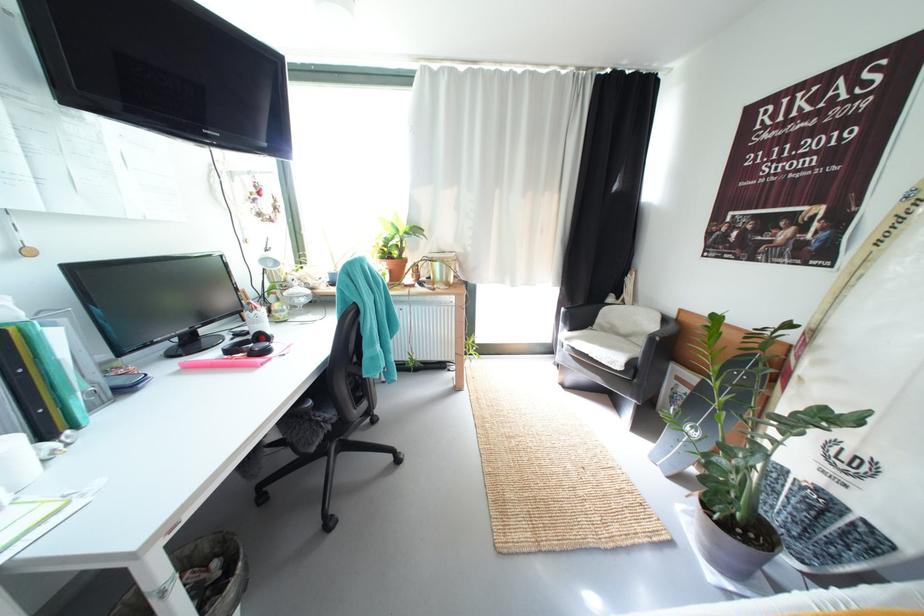
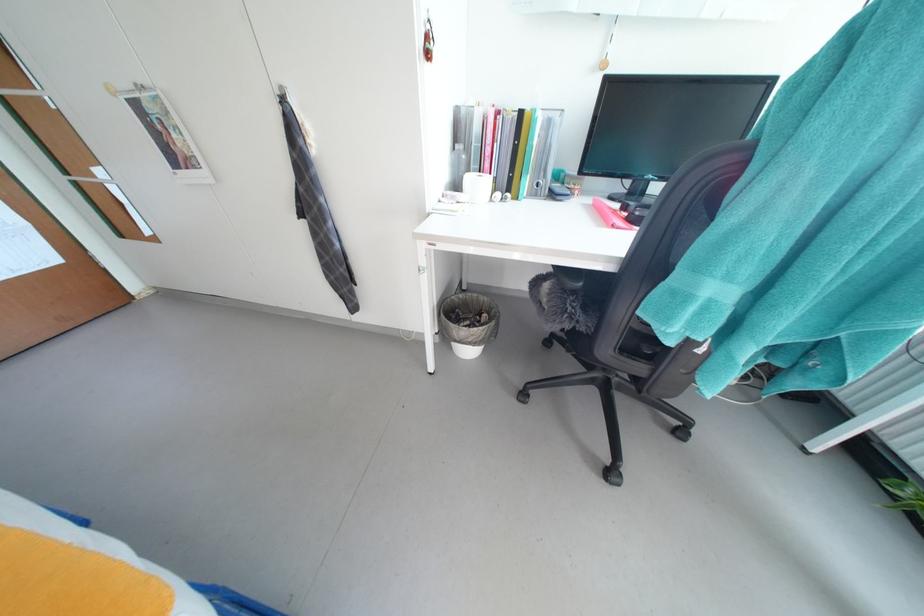
Where in the second image is the point corresponding to point 186,370 from the first image?

(599, 204)